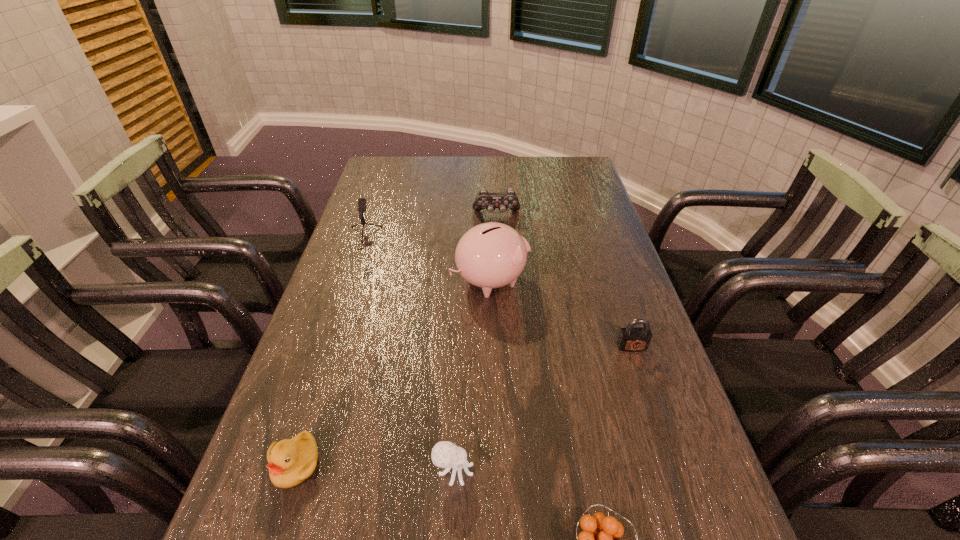
The width and height of the screenshot is (960, 540). In order to click on free spot located 0.400m on the surface of the farthest object with buttons in this screenshot , I will do `click(501, 308)`.

Locate an element on the screen. This screenshot has width=960, height=540. vacant space located on the front of the rightmost object near the keyhole is located at coordinates (670, 463).

At what (x,y) coordinates should I click in order to perform the action: click on vacant space situated on the front-facing side of the octopus. Please return your answer as a coordinate pair (x, y). Looking at the image, I should click on tap(660, 471).

This screenshot has width=960, height=540. I want to click on microphone situated at the left edge, so click(x=361, y=207).

Where is `duckling that is positioned at the left edge`? duckling that is positioned at the left edge is located at coordinates (290, 461).

Where is `object that is at the right edge`? The width and height of the screenshot is (960, 540). object that is at the right edge is located at coordinates (631, 338).

What are the coordinates of `free space at the far edge of the desktop` in the screenshot? It's located at (418, 172).

The width and height of the screenshot is (960, 540). Find the location of `vacant space at the left edge of the desktop`. vacant space at the left edge of the desktop is located at coordinates (298, 388).

Identify the location of free region at the right edge of the desktop. (626, 282).

Image resolution: width=960 pixels, height=540 pixels. In the image, there is a desktop. Find the location of `free space at the far left corner`. free space at the far left corner is located at coordinates (376, 158).